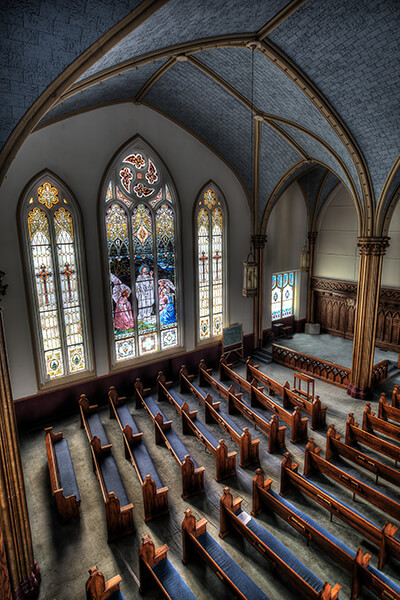
I want to click on floor, so coord(206,506).